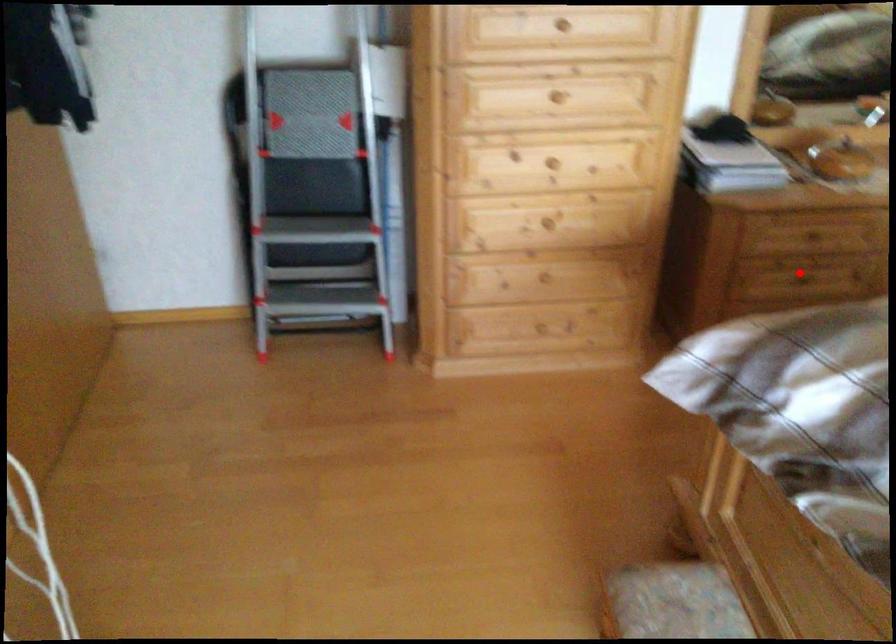
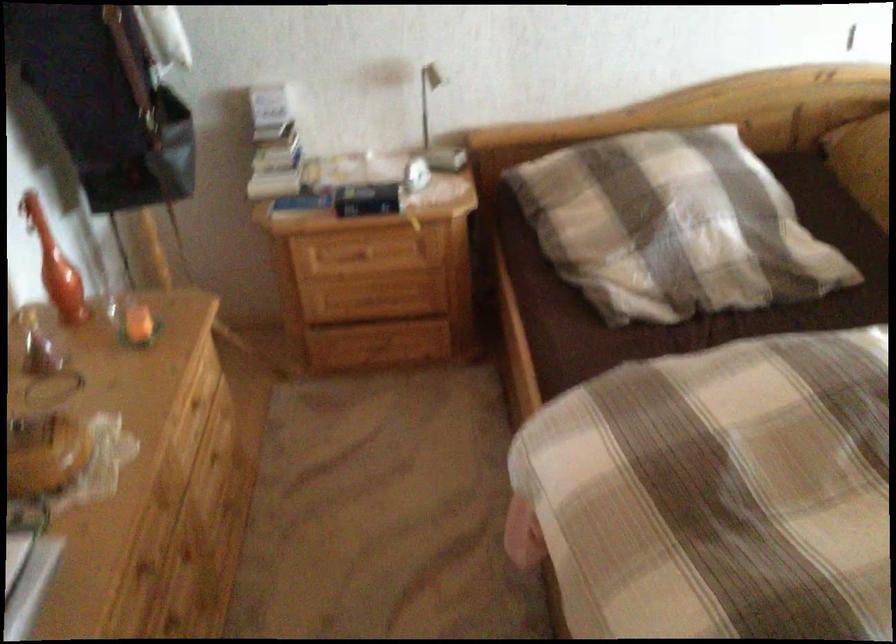
Question: I am providing you with two images of the same scene from different viewpoints. Image1 has a red point marked. In image2, the corresponding 3D location appears at what relative position? Reply with the corresponding letter.

Choices:
 (A) Closer
 (B) Farther

Answer: (A)